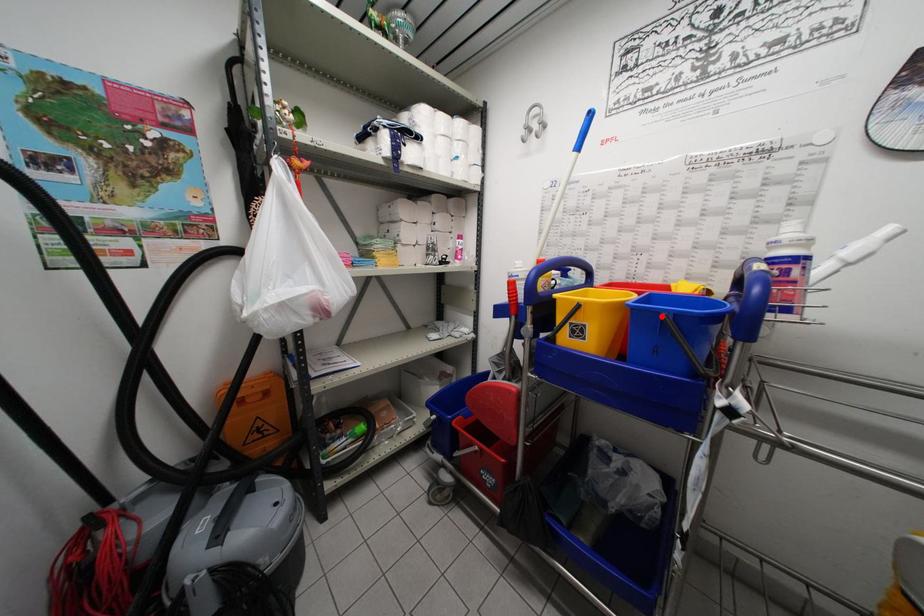
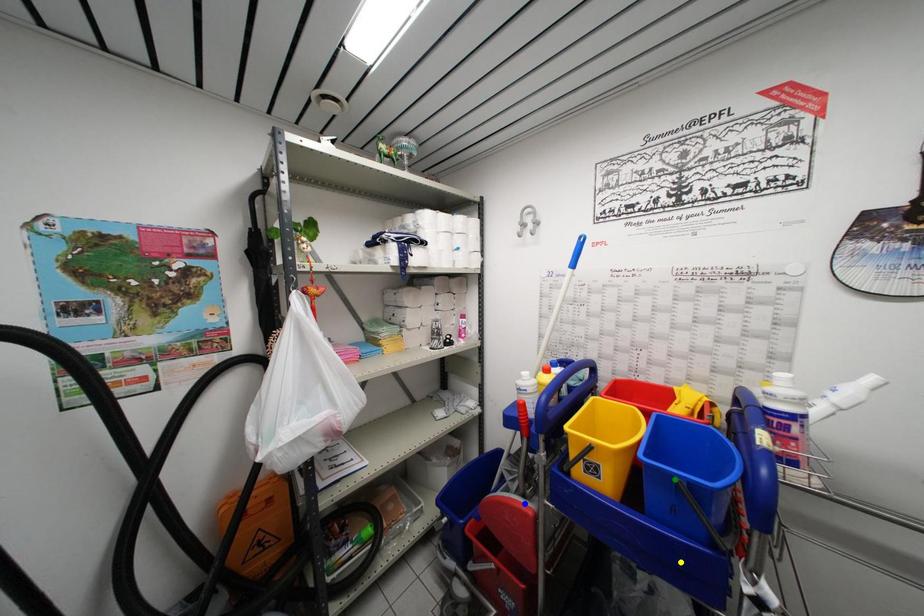
Question: I am providing you with two images of the same scene from different viewpoints. A red point is marked on the first image. You are given multiple points on the second image. Can you choose the point in image 2 that corresponds to the point in image 1?

Choices:
 (A) blue point
 (B) green point
 (C) yellow point

Answer: (B)